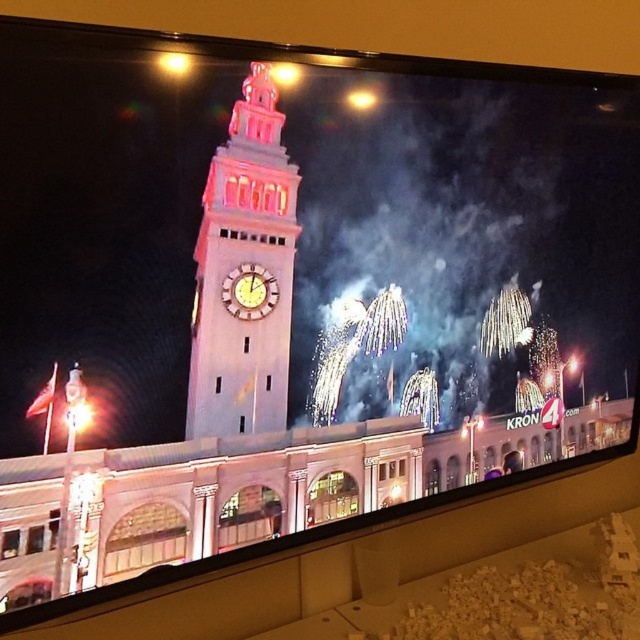
Question: Can you confirm if white stone clock tower at center is positioned to the right of gold metallic clock at center?

Choices:
 (A) yes
 (B) no

Answer: (A)

Question: Is white stone clock tower at center to the left of gold metallic clock at center from the viewer's perspective?

Choices:
 (A) no
 (B) yes

Answer: (A)

Question: Among these points, which one is nearest to the camera?

Choices:
 (A) (227, 148)
 (B) (230, 300)

Answer: (A)

Question: Can you confirm if white stone clock tower at center is smaller than gold metallic clock at center?

Choices:
 (A) no
 (B) yes

Answer: (A)

Question: Which of the following is the farthest from the observer?

Choices:
 (A) (224, 291)
 (B) (259, 380)

Answer: (B)